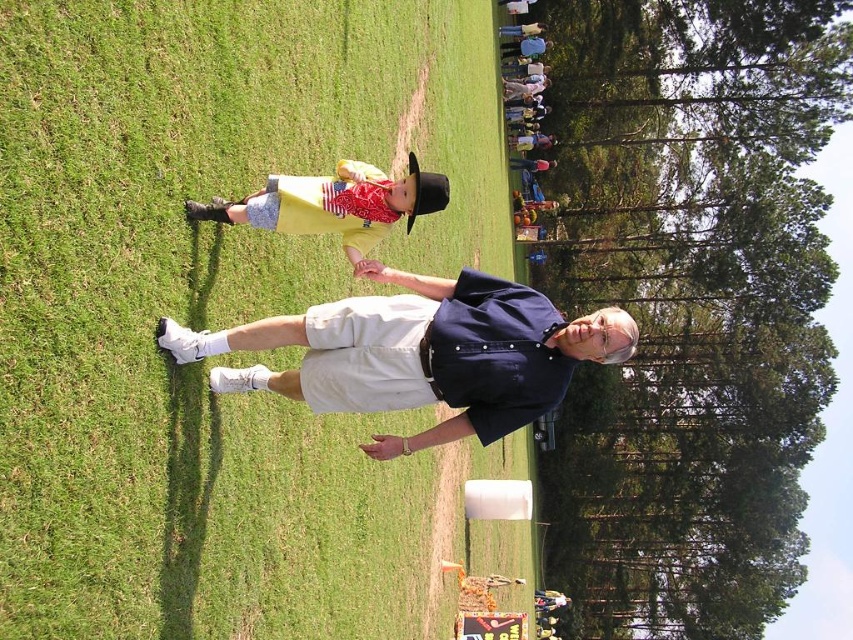
Consider the image. You are standing in the grassy field and want to take a photo of the dark blue shirt at center without the green grass at center appearing in the foreground. Is this possible?

The green grass at center is closer to the viewer than the dark blue shirt at center, so it will block the view of the dark blue shirt at center. Therefore, you cannot take a photo of the dark blue shirt at center without the green grass at center appearing in the foreground.

You are standing in the park and see two people at center, a dark blue shirt at center and a matte yellow shirt at center. Which one is closer to you?

The dark blue shirt at center is closer to you because it is further to the viewer than the matte yellow shirt at center.

You are standing in the middle of the grassy field and see two points marked on the ground. The first point is at coordinates point (490, 38) and the second point is at point (432, 316). Which point is closer to you?

Point (490, 38) is further to the viewer than point (432, 316), so the second point is closer to you.